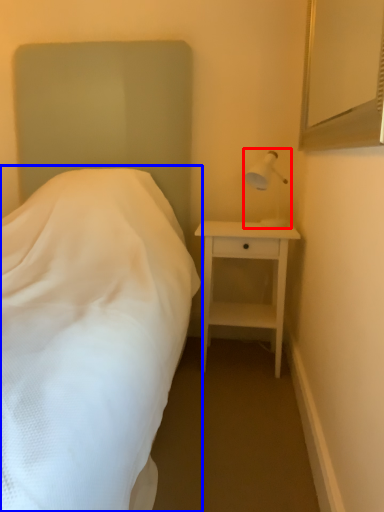
Question: Which of the following is the closest to the observer, bedside lamp (highlighted by a red box) or bed (highlighted by a blue box)?

Choices:
 (A) bedside lamp
 (B) bed

Answer: (B)